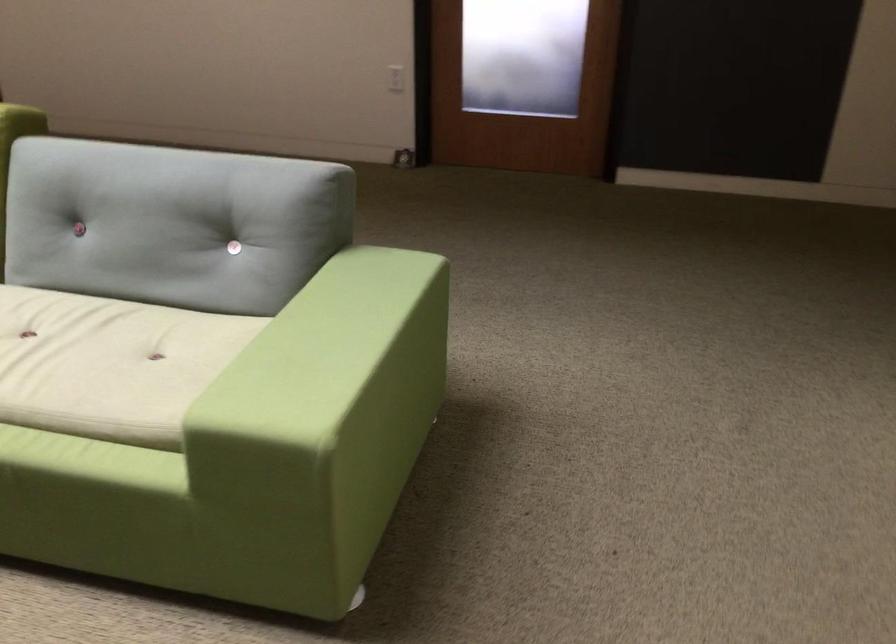
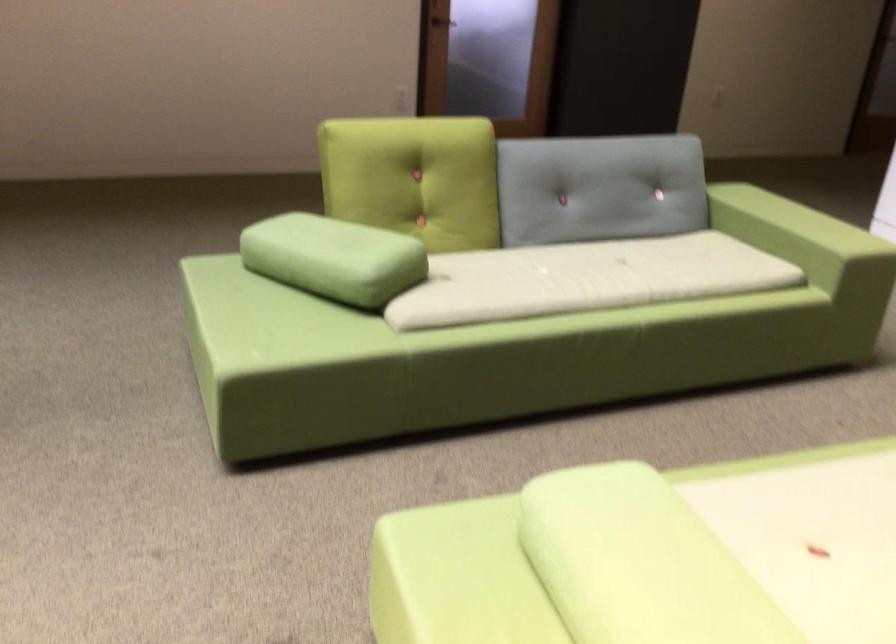
Find the pixel in the second image that matches (x=138, y=223) in the first image.

(599, 187)